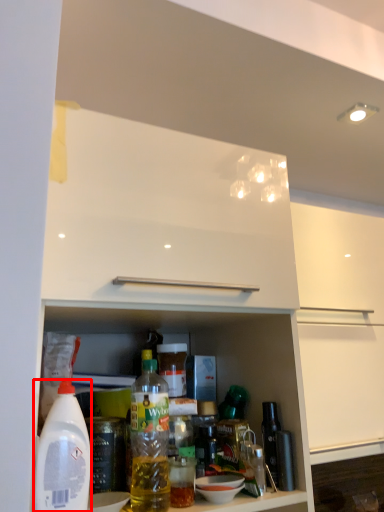
Question: From the image's perspective, where is bottle (annotated by the red box) located relative to bottle?

Choices:
 (A) above
 (B) below

Answer: (A)